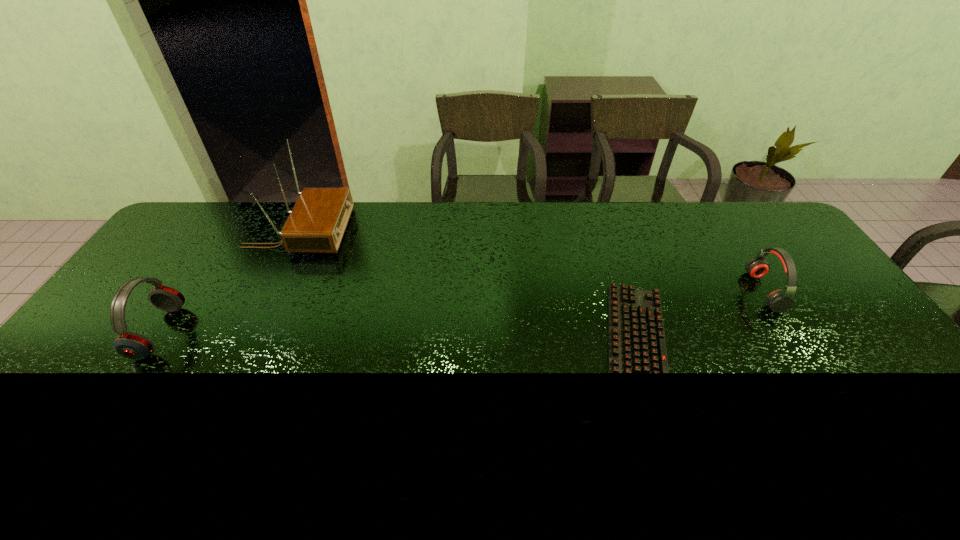
The width and height of the screenshot is (960, 540). I want to click on free space between the taller earphone and the right earphone, so click(x=462, y=312).

What are the coordinates of `free area in between the left earphone and the second object from right to left` in the screenshot? It's located at (398, 339).

The image size is (960, 540). What are the coordinates of `free space that is in between the third tallest object and the second tallest object` in the screenshot? It's located at (462, 312).

At what (x,y) coordinates should I click in order to perform the action: click on free space between the radio_receiver and the second object from right to left. Please return your answer as a coordinate pair (x, y). Looking at the image, I should click on (468, 289).

I want to click on vacant space in between the third object from left to right and the second tallest object, so click(398, 339).

Image resolution: width=960 pixels, height=540 pixels. In order to click on vacant point located between the computer keyboard and the third shortest object in this screenshot , I will do `click(398, 339)`.

Locate an element on the screen. free area in between the tallest object and the shortest object is located at coordinates (468, 289).

The image size is (960, 540). What are the coordinates of `free point between the third tallest object and the tallest object` in the screenshot? It's located at click(531, 262).

Where is `free space between the shortest object and the tallest object`? This screenshot has height=540, width=960. free space between the shortest object and the tallest object is located at coordinates pyautogui.click(x=468, y=289).

This screenshot has height=540, width=960. I want to click on empty location between the leftmost object and the shortest object, so click(x=398, y=339).